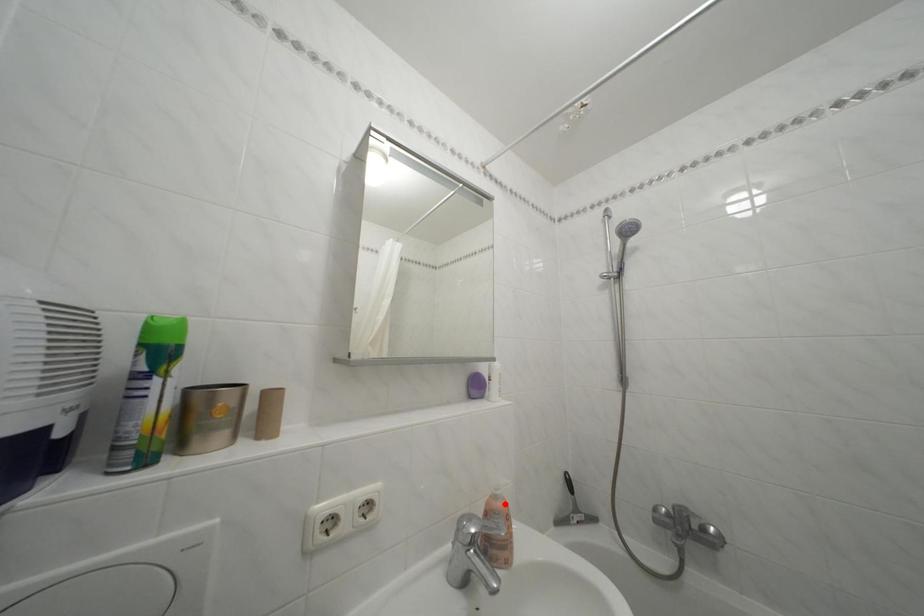
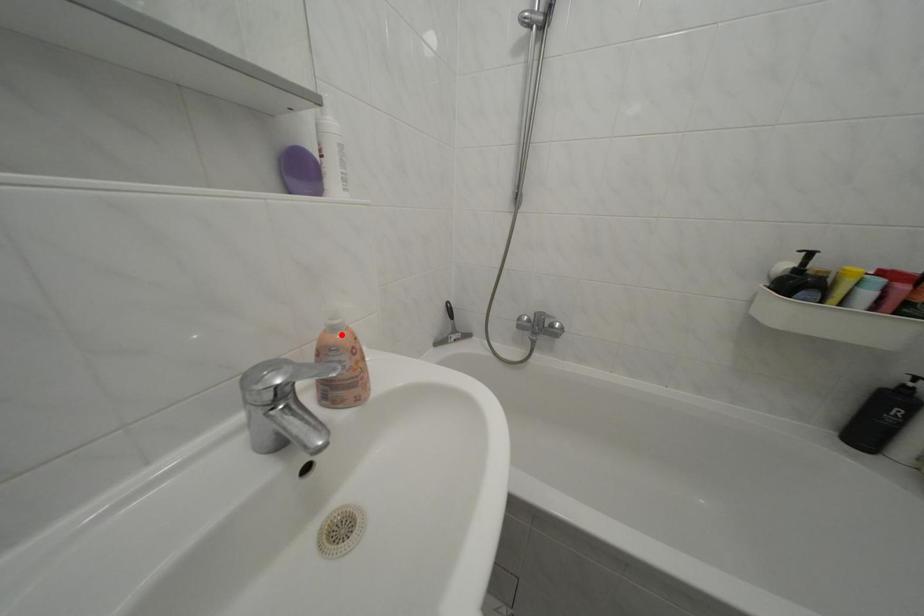
I am providing you with two images of the same scene from different viewpoints. A red point is marked on the first image and another point is marked on the second image. Is the marked point in image1 the same physical position as the marked point in image2?

Yes